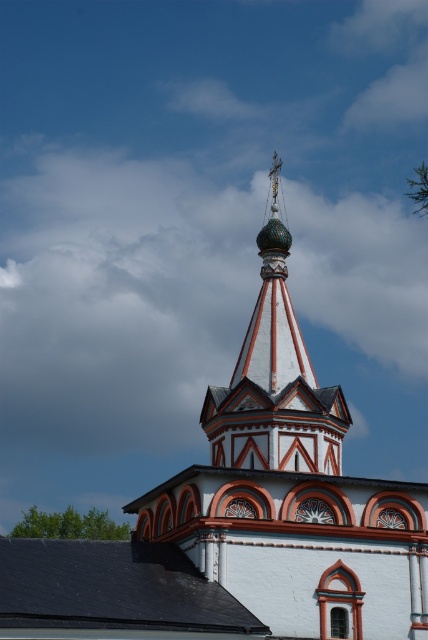
You are an architect designing a model of this church. You have to place the white painted wood bell tower at center and the polished gold dome at center. Which object should you make bigger in your model?

The white painted wood bell tower at center should be made bigger in the model since it is larger in size than the polished gold dome at center according to the description.

You are standing in front of the traditional Russian Orthodox church described. You notice the white painted wood bell tower at center and the polished gold dome at center. Which object is positioned higher in the scene?

The polished gold dome at center is positioned higher than the white painted wood bell tower at center.

You are an architect designing a scale model of this church. You need to ensure the white painted wood bell tower at center and the polished gold dome at center are proportionally accurate. Based on the description, which object should you make wider in your model?

The white painted wood bell tower at center should be made wider in the model since the description states it might be wider than the polished gold dome at center.